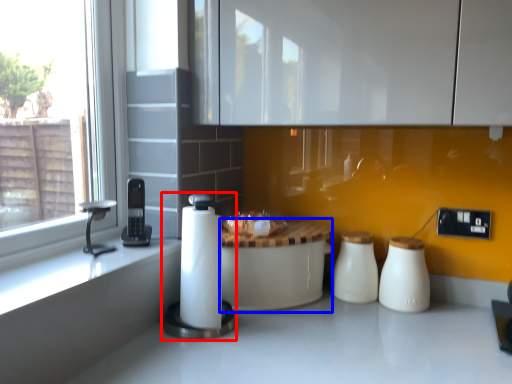
Question: Which of the following is the closest to the observer, appliance (highlighted by a red box) or table (highlighted by a blue box)?

Choices:
 (A) appliance
 (B) table

Answer: (A)